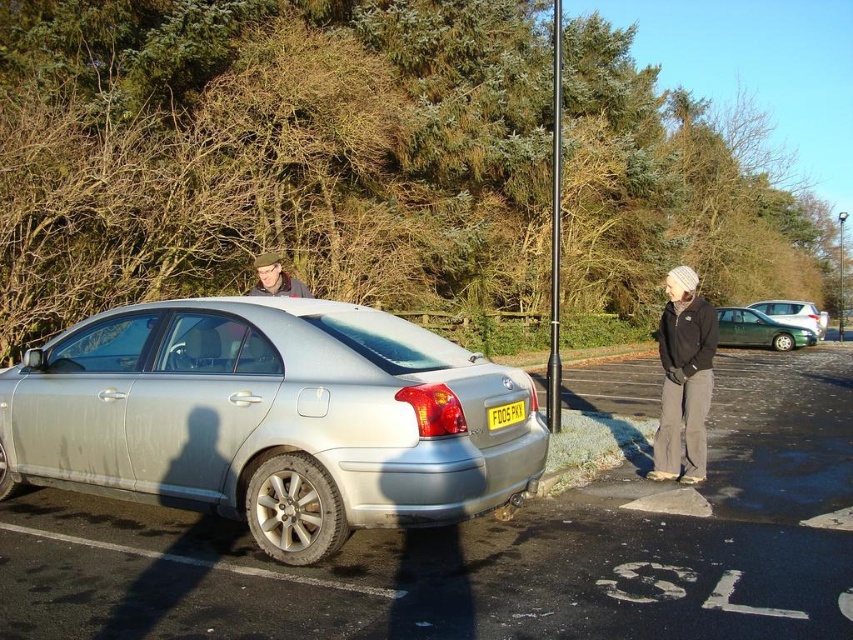
You are a delivery driver who needs to park your truck between the silver metallic sedan at center and the metallic silver pole at center. Based on the scene description, can you safely park your truck there without hitting either object?

The silver metallic sedan at center is below the metallic silver pole at center, meaning the pole is above the sedan. Since the pole is overhead, there should be enough vertical space to park the truck between them without hitting the pole. However, you need to ensure there is sufficient horizontal space between the sedan and the pole. The scene description does not provide information about the horizontal distance between the two objects, so you cannot determine if the truck can fit horizontally. Therefore

You are standing in the parking lot and want to walk from point A to point B. Point A is at coordinate point (80, 422) and point B is at coordinate point (556, 381). Since you want to take the shortest path possible, which direction should you head towards from point A to reach point B?

Since point A is closer to the viewer than point B, you should head towards the upper direction to reach point B from point A.